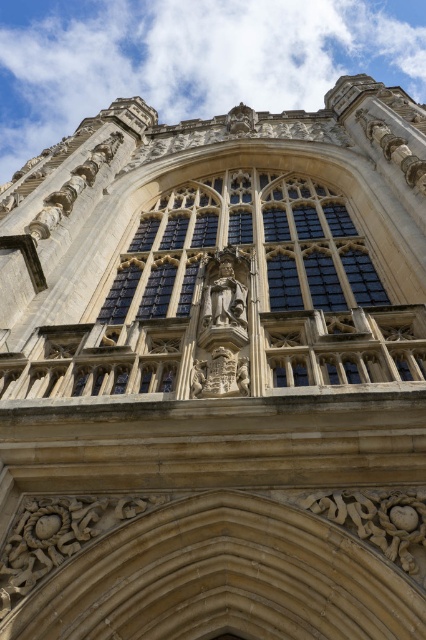
Question: Which object is positioned farthest from the carved stone statue at center?

Choices:
 (A) matte stone statue at center
 (B) dark glass window at center

Answer: (B)

Question: In this image, where is matte stone statue at center located relative to carved stone statue at center?

Choices:
 (A) below
 (B) above

Answer: (B)

Question: Which object is farther from the camera taking this photo?

Choices:
 (A) matte stone statue at center
 (B) dark glass window at center

Answer: (B)

Question: Estimate the real-world distances between objects in this image. Which object is closer to the carved stone statue at center?

Choices:
 (A) dark glass window at center
 (B) matte stone statue at center

Answer: (B)

Question: Is matte stone statue at center wider than carved stone statue at center?

Choices:
 (A) no
 (B) yes

Answer: (A)

Question: Can you confirm if dark glass window at center is positioned to the right of carved stone statue at center?

Choices:
 (A) no
 (B) yes

Answer: (B)